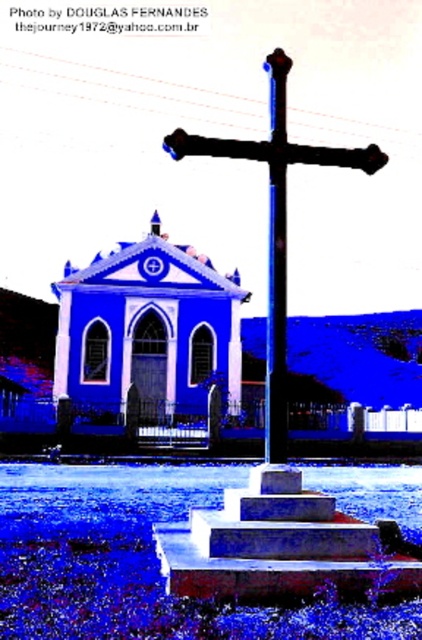
Who is more distant from viewer, (124, 365) or (273, 186)?

The point (124, 365) is behind.

Which is below, blue matte chapel at center or metallic pole at center?

Positioned lower is blue matte chapel at center.

Does point (113, 316) lie behind point (262, 157)?

Yes, it is.

Find the location of a particular element. This screenshot has height=640, width=422. blue matte chapel at center is located at coordinates (148, 333).

Does black metal cross at center have a greater width compared to metallic pole at center?

Yes, black metal cross at center is wider than metallic pole at center.

The image size is (422, 640). What are the coordinates of `black metal cross at center` in the screenshot? It's located at (275, 224).

Image resolution: width=422 pixels, height=640 pixels. I want to click on black metal cross at center, so click(x=275, y=224).

Is point (154, 305) farther from camera compared to point (186, 138)?

Yes, point (154, 305) is behind point (186, 138).

Who is lower down, blue matte chapel at center or black metal cross at center?

Positioned lower is blue matte chapel at center.

Identify the location of blue matte chapel at center. The width and height of the screenshot is (422, 640). (148, 333).